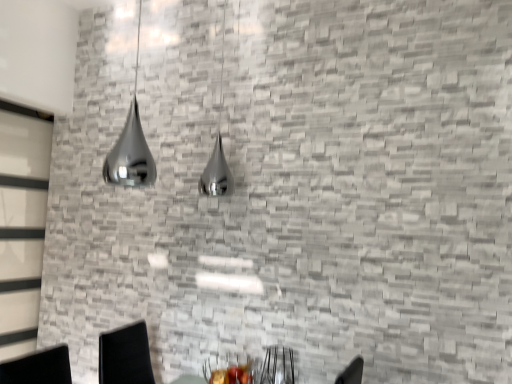
Question: From the image's perspective, is metallic black armchair at lower center below shiny metallic lamp at upper left?

Choices:
 (A) yes
 (B) no

Answer: (A)

Question: Can shiny metallic lamp at upper left be found inside metallic black armchair at lower center?

Choices:
 (A) yes
 (B) no

Answer: (B)

Question: Is metallic black armchair at lower center behind shiny metallic lamp at upper left?

Choices:
 (A) yes
 (B) no

Answer: (A)

Question: From a real-world perspective, is metallic black armchair at lower center positioned over shiny metallic lamp at upper left based on gravity?

Choices:
 (A) no
 (B) yes

Answer: (A)

Question: Considering the relative sizes of metallic black armchair at lower center and shiny metallic lamp at upper left in the image provided, is metallic black armchair at lower center wider than shiny metallic lamp at upper left?

Choices:
 (A) no
 (B) yes

Answer: (A)

Question: Is metallic black armchair at lower center taller than shiny metallic lamp at upper left?

Choices:
 (A) no
 (B) yes

Answer: (A)

Question: Is the surface of clear glass door at left in direct contact with shiny metallic lamp at upper left?

Choices:
 (A) yes
 (B) no

Answer: (B)

Question: Is shiny metallic lamp at upper left completely or partially inside clear glass door at left?

Choices:
 (A) yes
 (B) no

Answer: (B)

Question: Can you confirm if clear glass door at left is taller than shiny metallic lamp at upper left?

Choices:
 (A) yes
 (B) no

Answer: (A)

Question: Is clear glass door at left positioned far away from shiny metallic lamp at upper left?

Choices:
 (A) yes
 (B) no

Answer: (B)

Question: Is clear glass door at left not within shiny metallic lamp at upper left?

Choices:
 (A) no
 (B) yes

Answer: (B)

Question: Considering the relative sizes of clear glass door at left and shiny metallic lamp at upper left in the image provided, is clear glass door at left shorter than shiny metallic lamp at upper left?

Choices:
 (A) no
 (B) yes

Answer: (A)

Question: Is shiny metallic lamp at upper left at the right side of clear glass door at left?

Choices:
 (A) yes
 (B) no

Answer: (A)